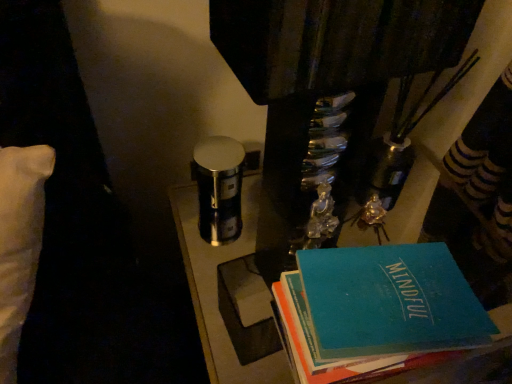
The image size is (512, 384). I want to click on free location above teal matte book at lower right (from a real-world perspective), so click(398, 305).